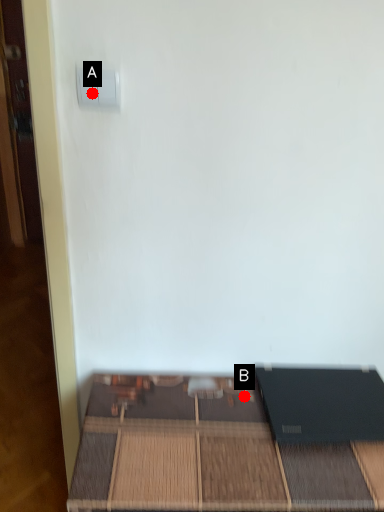
Question: Two points are circled on the image, labeled by A and B beside each circle. Which point appears closest to the camera in this image?

Choices:
 (A) A is closer
 (B) B is closer

Answer: (A)